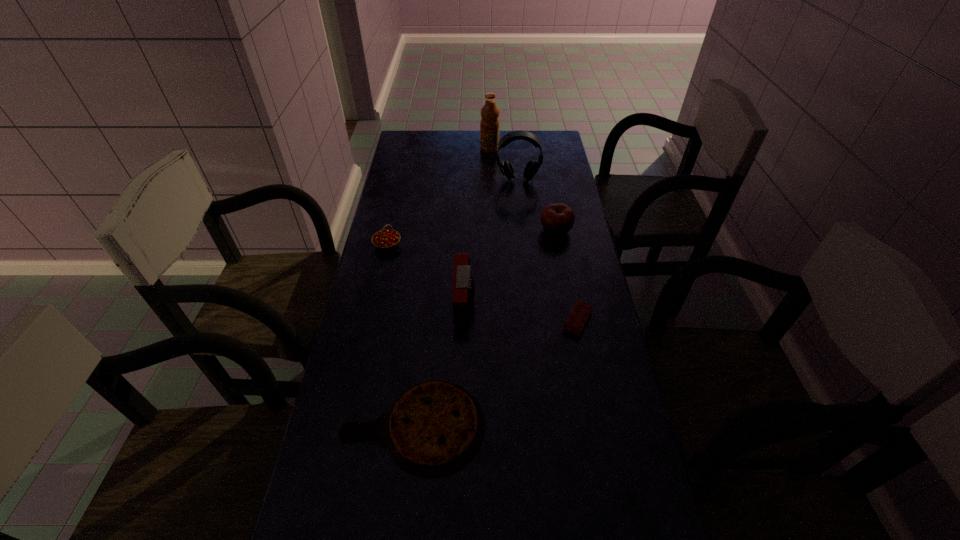
What are the coordinates of `free region that satisfies the following two spatial constraints: 1. on the ear cups of the earphone; 2. on the front-facing side of the camera` in the screenshot? It's located at (531, 301).

Where is `vacant space that satisfies the following two spatial constraints: 1. on the front-facing side of the camera; 2. on the back side of the Lego`? Image resolution: width=960 pixels, height=540 pixels. vacant space that satisfies the following two spatial constraints: 1. on the front-facing side of the camera; 2. on the back side of the Lego is located at coordinates [465, 321].

The width and height of the screenshot is (960, 540). What are the coordinates of `free spot that satisfies the following two spatial constraints: 1. on the ear cups of the apple; 2. on the left side of the second tallest object` in the screenshot? It's located at (523, 230).